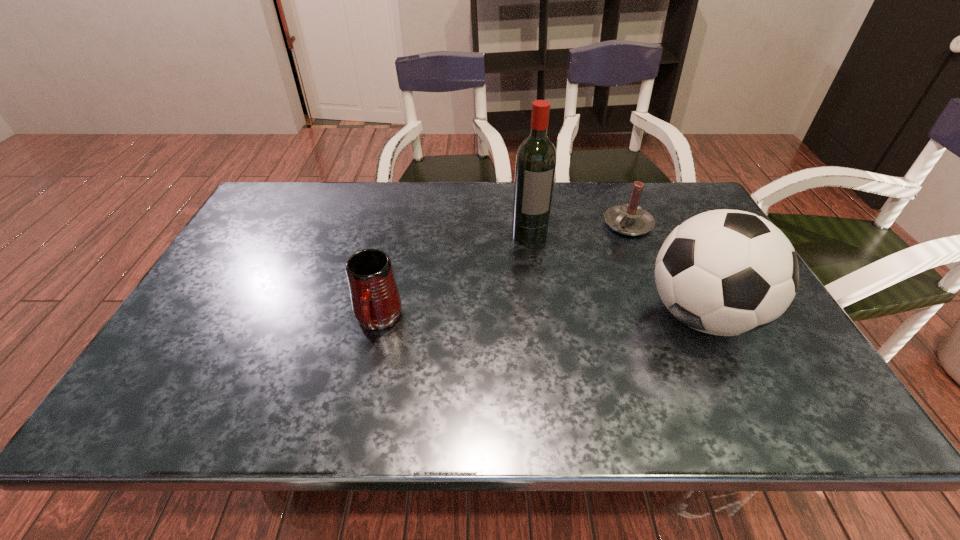
Find the location of a particular element. Image resolution: width=960 pixels, height=540 pixels. vacant space in between the tallest object and the soccer ball is located at coordinates (615, 275).

I want to click on the third closest object to the soccer ball, so click(376, 303).

Select which object is the second closest to the candle. Please provide its 2D coordinates. Your answer should be formatted as a tuple, i.e. [(x, y)], where the tuple contains the x and y coordinates of a point satisfying the conditions above.

[(536, 158)]